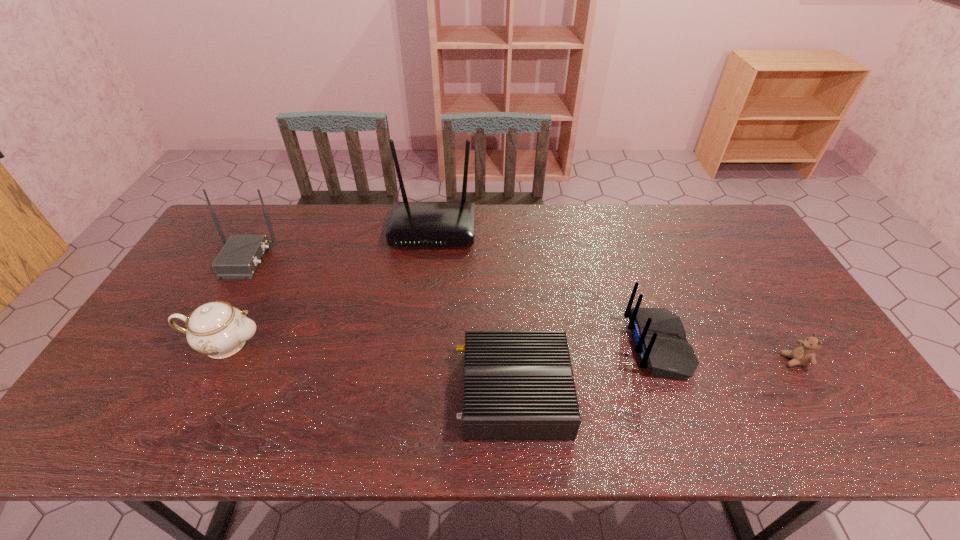
In the image, there is a desktop. What are the coordinates of `free space at the near right corner` in the screenshot? It's located at (819, 417).

Locate an element on the screen. The width and height of the screenshot is (960, 540). free space between the rightmost router and the teddy bear is located at coordinates (726, 353).

Identify the location of vacant area that lies between the shortest router and the tallest router. The image size is (960, 540). (473, 311).

Locate an element on the screen. Image resolution: width=960 pixels, height=540 pixels. empty space between the chinaware and the second tallest router is located at coordinates (234, 301).

Image resolution: width=960 pixels, height=540 pixels. I want to click on vacant space that is in between the fifth shortest object and the tallest object, so click(x=339, y=244).

The width and height of the screenshot is (960, 540). I want to click on free area in between the shortest router and the tallest router, so click(x=473, y=311).

I want to click on free point between the rightmost router and the shortest router, so click(x=587, y=369).

At what (x,y) coordinates should I click in order to perform the action: click on vacant area between the tallest object and the rightmost router. Please return your answer as a coordinate pair (x, y). Looking at the image, I should click on (545, 287).

The height and width of the screenshot is (540, 960). Identify the location of vacant space that's between the leftmost router and the shortest router. (379, 326).

Where is `vacant area that lies between the fifth object from left to right and the tallest router`? The height and width of the screenshot is (540, 960). vacant area that lies between the fifth object from left to right and the tallest router is located at coordinates (545, 287).